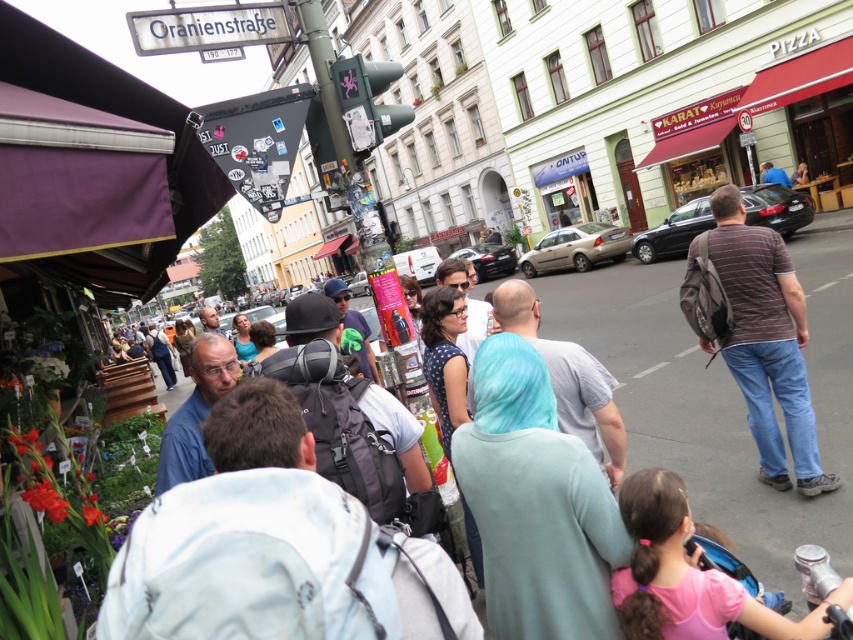
You are a tourist in Berlin and see the purple fabric canopy at upper left and the striped cotton shirt at center. Which object is positioned more to the left in the scene?

The purple fabric canopy at upper left is positioned to the left of the striped cotton shirt at center, so it is more to the left.

You are a photographer standing on the street in Berlin. You want to take a photo of the striped cotton shirt at center without the purple fabric canopy at upper left appearing in the frame. Is this possible given their positions?

The purple fabric canopy at upper left is positioned over the striped cotton shirt at center, so it would block the view. Therefore, it is not possible to take a photo of the striped cotton shirt at center without the purple fabric canopy at upper left appearing in the frame.

You are a photographer standing at the edge of the street in Berlin. You want to capture a photo that includes both the purple fabric canopy at upper left and the striped cotton shirt at center. Which object should you focus on first if you want to ensure both are in frame without moving the camera?

The purple fabric canopy at upper left is larger in size than the striped cotton shirt at center, so you should focus on the purple fabric canopy at upper left first to ensure it fits within the frame, then adjust to include the smaller striped cotton shirt at center.